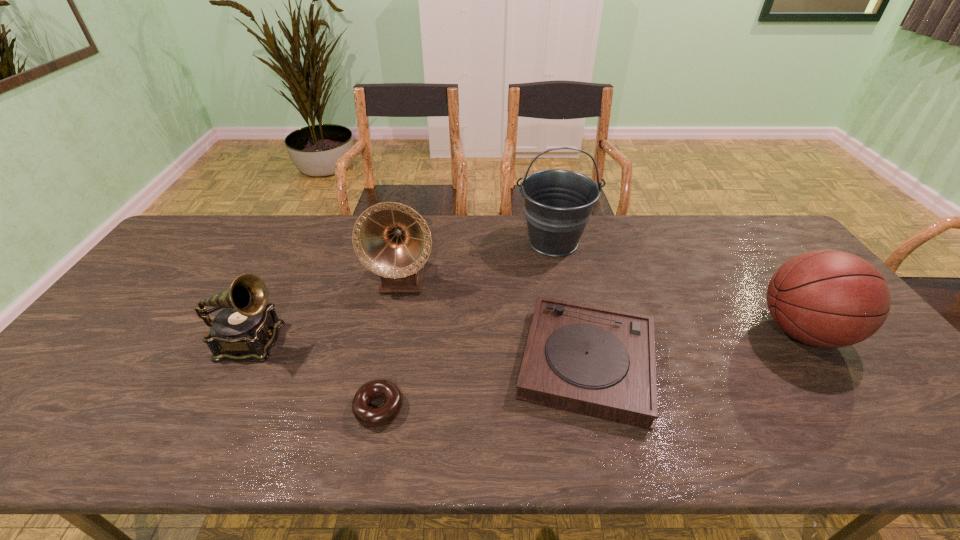
Where is `bucket`? This screenshot has height=540, width=960. bucket is located at coordinates (558, 203).

This screenshot has width=960, height=540. Find the location of `the second phonograph record from right to left`. the second phonograph record from right to left is located at coordinates (392, 240).

Where is `the leftmost phonograph record`? This screenshot has width=960, height=540. the leftmost phonograph record is located at coordinates (247, 327).

Where is `the second tallest phonograph record`? The height and width of the screenshot is (540, 960). the second tallest phonograph record is located at coordinates (247, 327).

Identify the location of basketball. [x=827, y=298].

Identify the location of the shortest phonograph record. (600, 362).

You are a GUI agent. You are given a task and a screenshot of the screen. Output one action in this format:
    pyautogui.click(x=<x>, y=<y>)
    Task: Click on the rightmost phonograph record
    
    Given the screenshot: What is the action you would take?
    pyautogui.click(x=600, y=362)

At what (x,y) coordinates should I click in order to perform the action: click on the shortest object. Please return your answer as a coordinate pair (x, y). Image resolution: width=960 pixels, height=540 pixels. Looking at the image, I should click on (372, 417).

I want to click on free location located 0.120m on the front of the bucket, so click(x=564, y=291).

I want to click on free spot located 0.340m on the horn of the farthest phonograph record, so click(x=377, y=404).